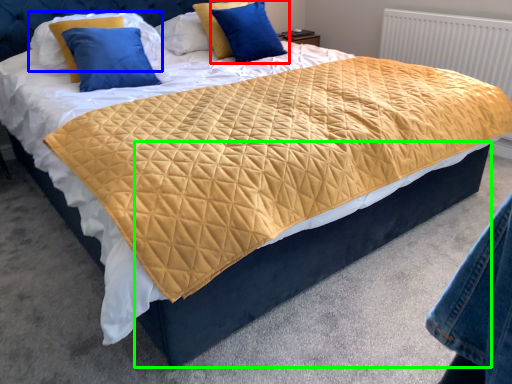
Question: Considering the real-world distances, which object is farthest from pillow (highlighted by a red box)? pillow (highlighted by a blue box) or bed frame (highlighted by a green box)?

Choices:
 (A) pillow
 (B) bed frame

Answer: (B)